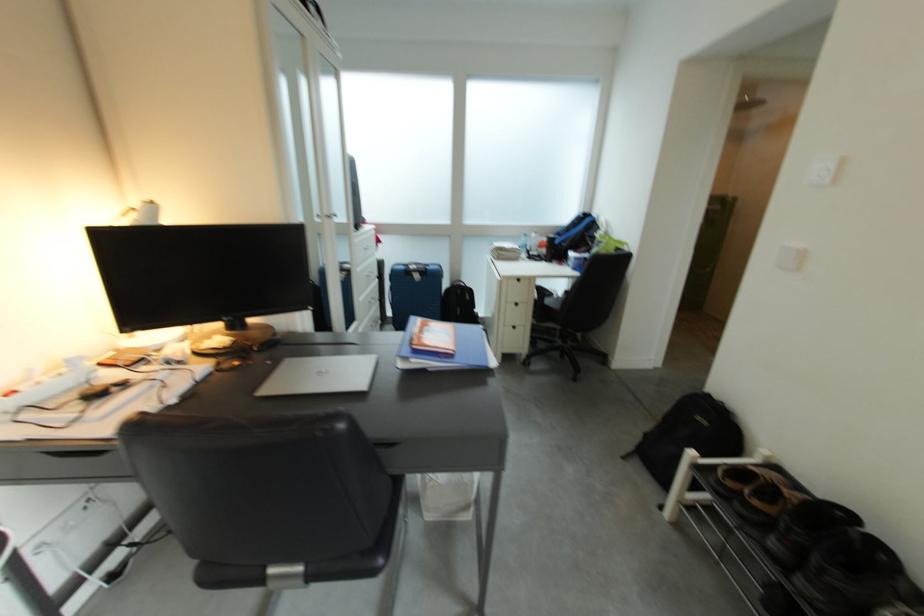
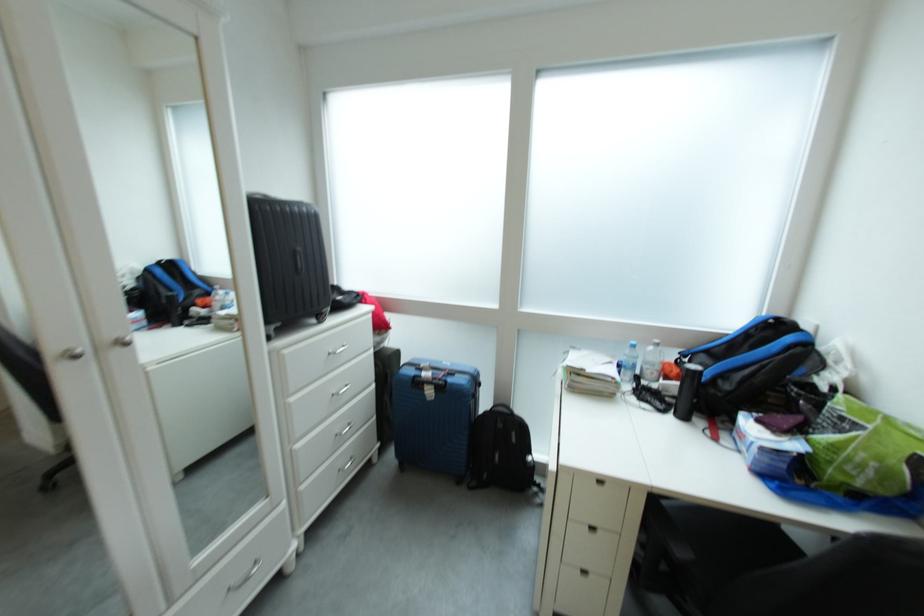
Where in the second image is the point corresponding to [540,252] from the first image?

(650, 376)